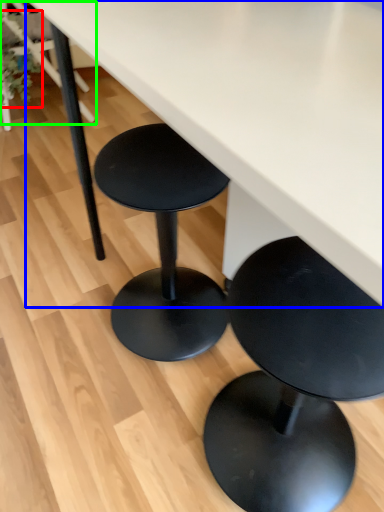
Question: Which object is positioned farthest from plant (highlighted by a red box)? Select from table (highlighted by a blue box) and chair (highlighted by a green box).

Choices:
 (A) table
 (B) chair

Answer: (A)